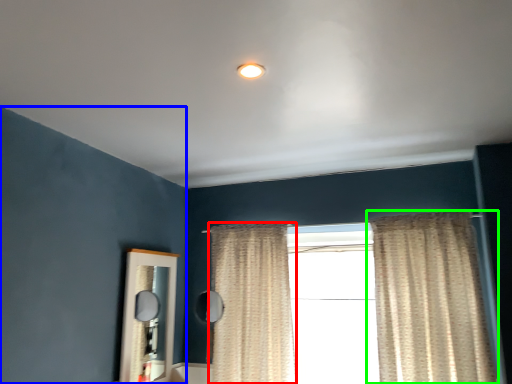
Question: Which object is the farthest from curtain (highlighted by a red box)? Choose among these: backdrop (highlighted by a blue box) or curtain (highlighted by a green box).

Choices:
 (A) backdrop
 (B) curtain

Answer: (A)